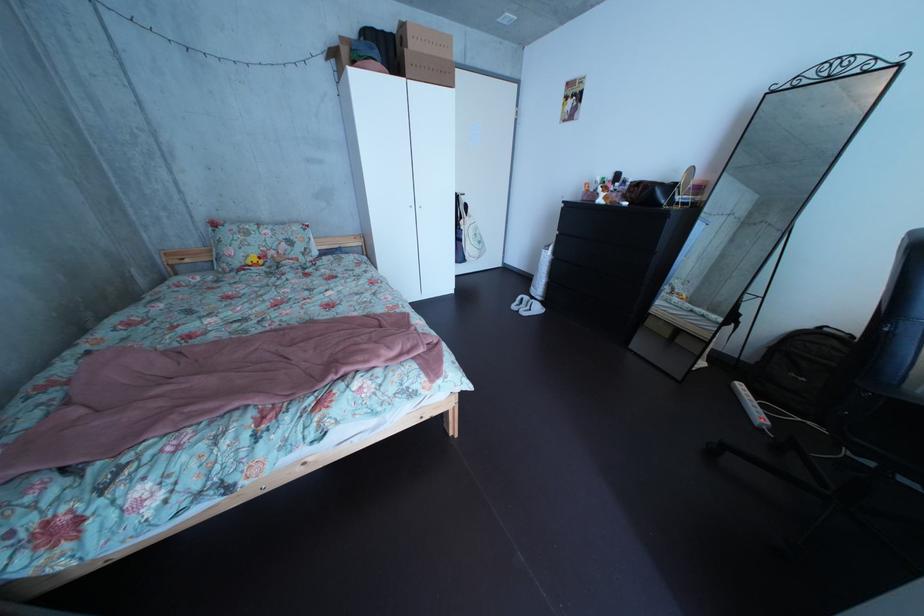
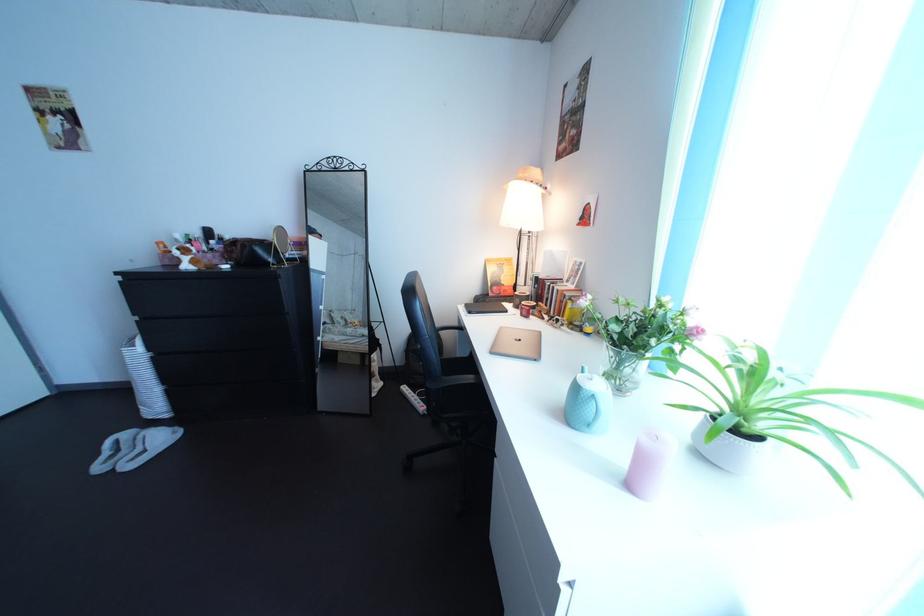
Question: The first image is from the beginning of the video and the second image is from the end. How did the camera likely rotate when shooting the video?

Choices:
 (A) Left
 (B) Right
 (C) Up
 (D) Down

Answer: (B)